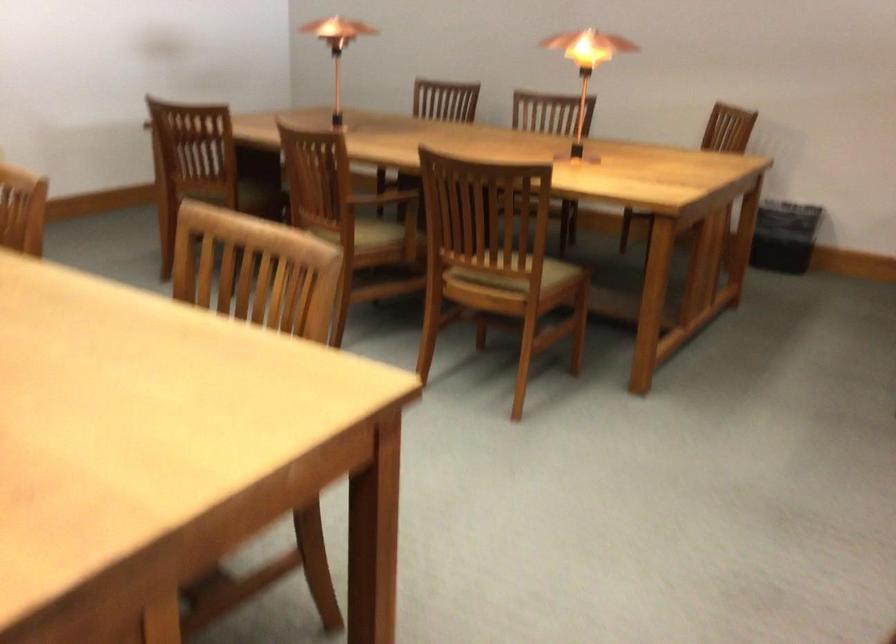
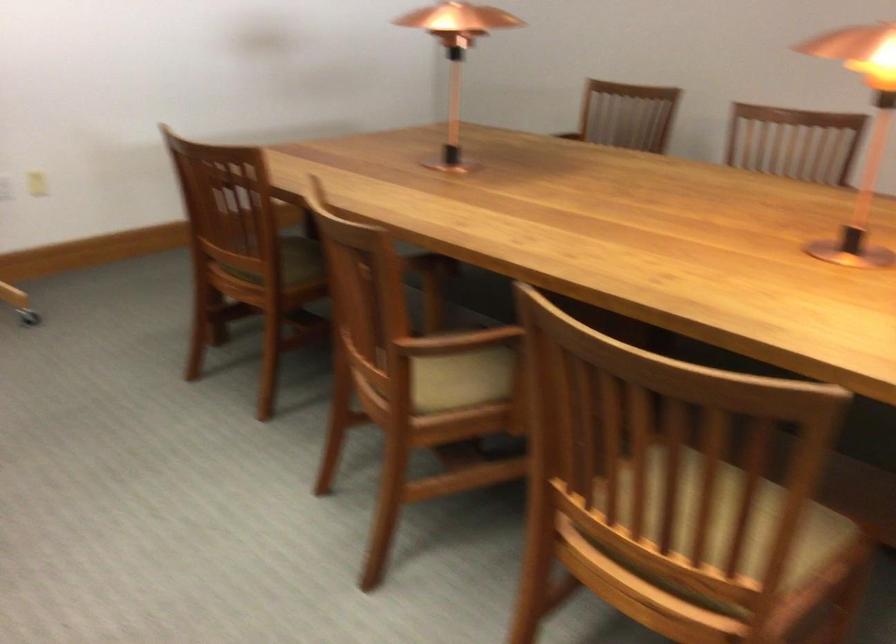
Where in the second image is the point corresponding to point (375, 223) from the first image?

(460, 377)